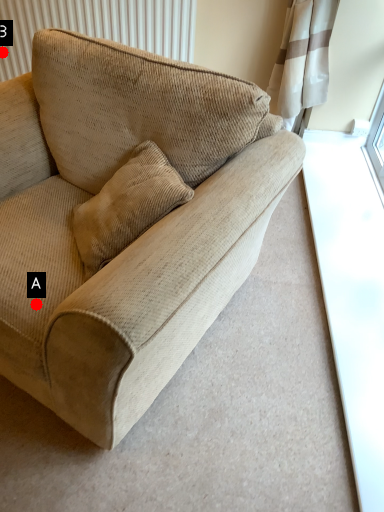
Question: Two points are circled on the image, labeled by A and B beside each circle. Which point is closer to the camera?

Choices:
 (A) A is closer
 (B) B is closer

Answer: (A)